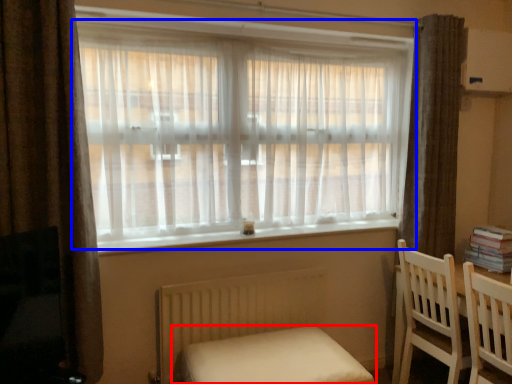
Question: Which object is further to the camera taking this photo, furniture (highlighted by a red box) or window (highlighted by a blue box)?

Choices:
 (A) furniture
 (B) window

Answer: (B)